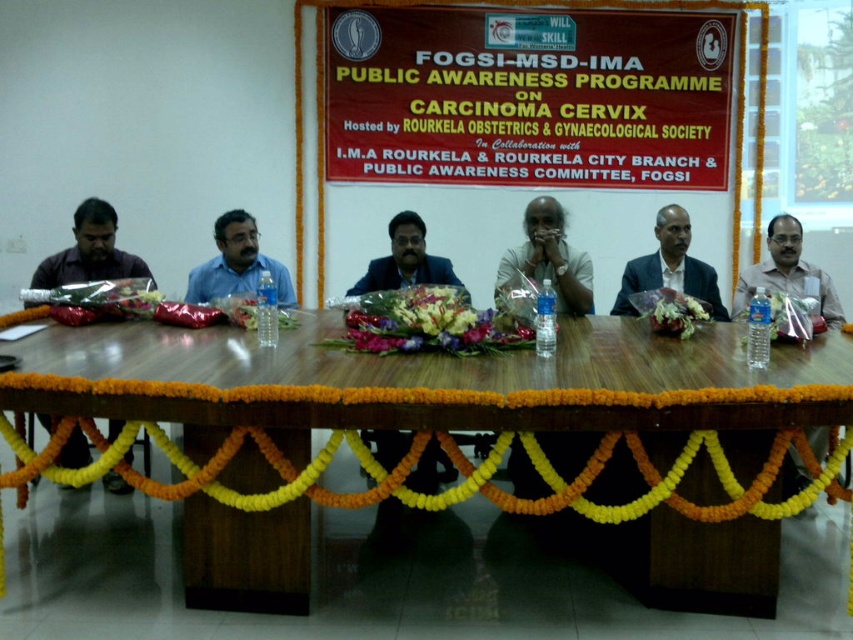
You are a photographer adjusting your camera to focus on two points in the scene. The first point is at coordinate point(109, 422) and the second is at point(824, 284). Which point should you focus on first if you want to ensure both points are in focus?

You should focus on point(109, 422) first because it is closer to the camera than point(824, 284), ensuring the depth of field captures both points when focused on the closer one.

You are sitting at the wooden table at center and want to hand a document to the person wearing the matte black shirt at center. In which direction should you pass the document?

You should pass the document to your right because the wooden table at center is to the left of the matte black shirt at center, meaning the person wearing the matte black shirt is sitting to your right.

You are a photographer standing at the back of the room. You want to take a photo of the wooden table at center and the matte black shirt at center such that both are in focus. Given that your camera has a depth of field that can cover 28 inches, will you be able to capture both objects in focus without adjusting your camera settings?

The distance between the wooden table at center and the matte black shirt at center is 27.82 inches, which is just under the camera depth of field of 28 inches. Therefore, you can capture both objects in focus without adjusting your camera settings.